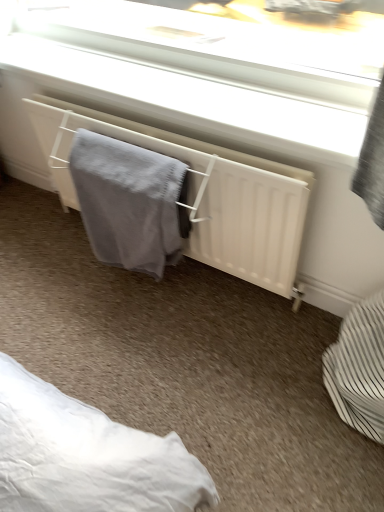
Question: Would you say white matte radiator at center is outside gray knitted towel at center?

Choices:
 (A) no
 (B) yes

Answer: (A)

Question: Does white matte radiator at center have a larger size compared to gray knitted towel at center?

Choices:
 (A) no
 (B) yes

Answer: (B)

Question: Is white matte radiator at center positioned far away from gray knitted towel at center?

Choices:
 (A) yes
 (B) no

Answer: (B)

Question: Is white matte radiator at center taller than gray knitted towel at center?

Choices:
 (A) yes
 (B) no

Answer: (B)

Question: Does white matte radiator at center appear on the left side of gray knitted towel at center?

Choices:
 (A) yes
 (B) no

Answer: (B)

Question: Considering the relative sizes of white matte radiator at center and gray knitted towel at center in the image provided, is white matte radiator at center shorter than gray knitted towel at center?

Choices:
 (A) yes
 (B) no

Answer: (A)

Question: Can you confirm if gray knitted towel at center is wider than white striped basket at lower right?

Choices:
 (A) no
 (B) yes

Answer: (A)

Question: Is gray knitted towel at center beside white striped basket at lower right?

Choices:
 (A) yes
 (B) no

Answer: (B)

Question: Does gray knitted towel at center have a lesser width compared to white striped basket at lower right?

Choices:
 (A) no
 (B) yes

Answer: (B)

Question: Is white striped basket at lower right located within gray knitted towel at center?

Choices:
 (A) yes
 (B) no

Answer: (B)

Question: From the image's perspective, is gray knitted towel at center located above white striped basket at lower right?

Choices:
 (A) yes
 (B) no

Answer: (A)

Question: Could you tell me if gray knitted towel at center is facing white striped basket at lower right?

Choices:
 (A) yes
 (B) no

Answer: (B)

Question: Does white matte radiator at center have a greater width compared to white striped basket at lower right?

Choices:
 (A) yes
 (B) no

Answer: (B)